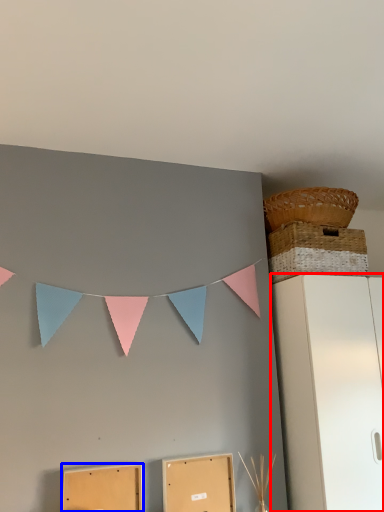
Question: Which of the following is the farthest to the observer, furniture (highlighted by a red box) or cardboard box (highlighted by a blue box)?

Choices:
 (A) furniture
 (B) cardboard box

Answer: (A)